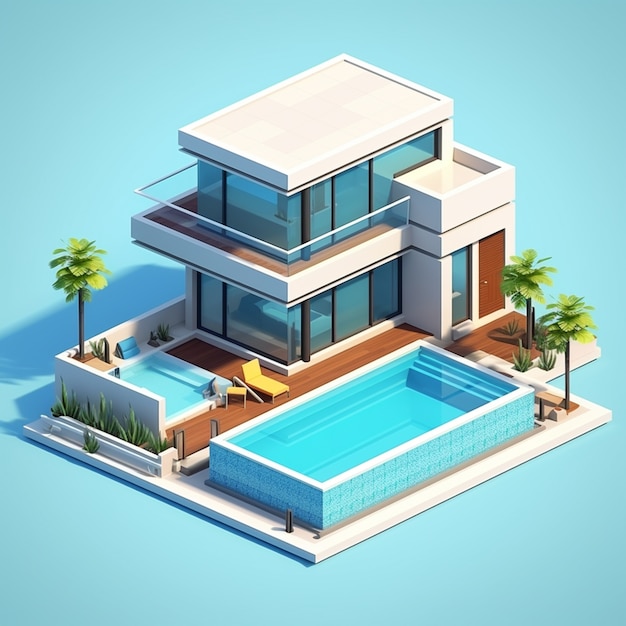
I want to click on window, so click(240, 310).